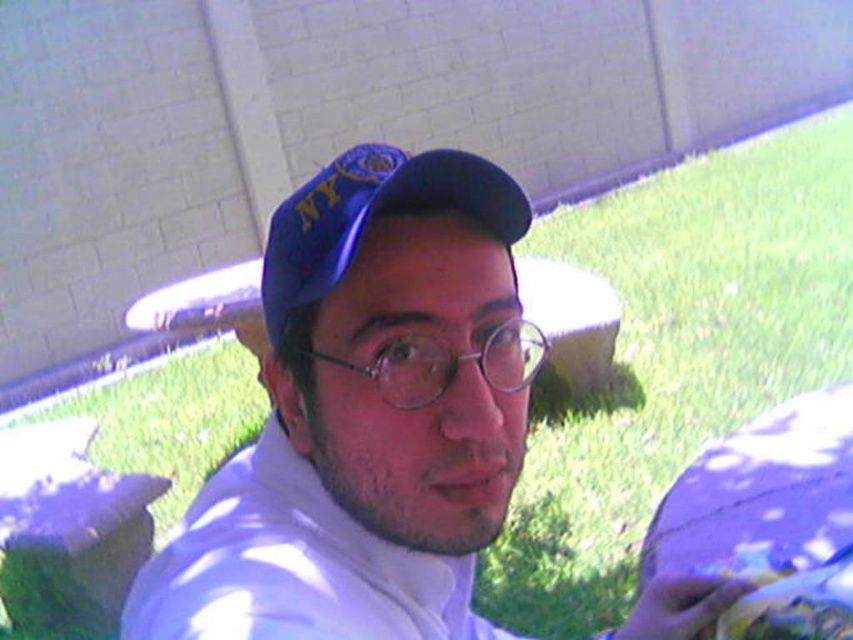
How far apart are white matte shirt at center and blue fabric cap at center?

white matte shirt at center and blue fabric cap at center are 6.26 inches apart from each other.

Is white matte shirt at center to the left of blue fabric cap at center from the viewer's perspective?

Incorrect, white matte shirt at center is not on the left side of blue fabric cap at center.

You are a GUI agent. You are given a task and a screenshot of the screen. Output one action in this format:
    pyautogui.click(x=<x>, y=<y>)
    Task: Click on the white matte shirt at center
    The width and height of the screenshot is (853, 640).
    Given the screenshot: What is the action you would take?
    pyautogui.click(x=366, y=417)